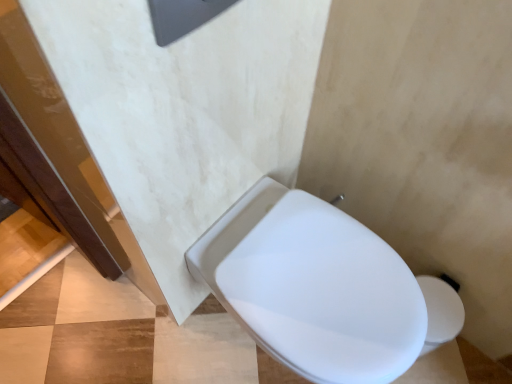
You are a GUI agent. You are given a task and a screenshot of the screen. Output one action in this format:
    pyautogui.click(x=<x>, y=<y>)
    Task: Click on the vacant space situated on the left part of white glossy toilet at center
    
    Given the screenshot: What is the action you would take?
    pyautogui.click(x=157, y=346)